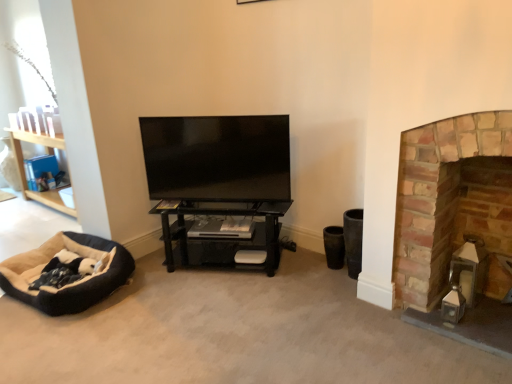
Question: Can we say soft beige fabric dog bed at lower left lies outside brick fireplace at right?

Choices:
 (A) yes
 (B) no

Answer: (A)

Question: Does soft beige fabric dog bed at lower left come in front of brick fireplace at right?

Choices:
 (A) no
 (B) yes

Answer: (A)

Question: Is soft beige fabric dog bed at lower left next to brick fireplace at right?

Choices:
 (A) yes
 (B) no

Answer: (B)

Question: From a real-world perspective, does soft beige fabric dog bed at lower left sit lower than brick fireplace at right?

Choices:
 (A) no
 (B) yes

Answer: (B)

Question: Does soft beige fabric dog bed at lower left have a smaller size compared to brick fireplace at right?

Choices:
 (A) yes
 (B) no

Answer: (A)

Question: Could you tell me if soft beige fabric dog bed at lower left is turned towards brick fireplace at right?

Choices:
 (A) yes
 (B) no

Answer: (B)

Question: Is there a large distance between brick fireplace at right and black matte shelf at center?

Choices:
 (A) yes
 (B) no

Answer: (A)

Question: Is brick fireplace at right further to camera compared to black matte shelf at center?

Choices:
 (A) yes
 (B) no

Answer: (B)

Question: From a real-world perspective, is brick fireplace at right over black matte shelf at center?

Choices:
 (A) no
 (B) yes

Answer: (B)

Question: From a real-world perspective, is brick fireplace at right located beneath black matte shelf at center?

Choices:
 (A) yes
 (B) no

Answer: (B)

Question: Considering the relative sizes of brick fireplace at right and black matte shelf at center in the image provided, is brick fireplace at right bigger than black matte shelf at center?

Choices:
 (A) yes
 (B) no

Answer: (A)

Question: Is brick fireplace at right next to black matte shelf at center and touching it?

Choices:
 (A) yes
 (B) no

Answer: (B)

Question: Is brick fireplace at right oriented away from flat screen tv at center?

Choices:
 (A) yes
 (B) no

Answer: (B)